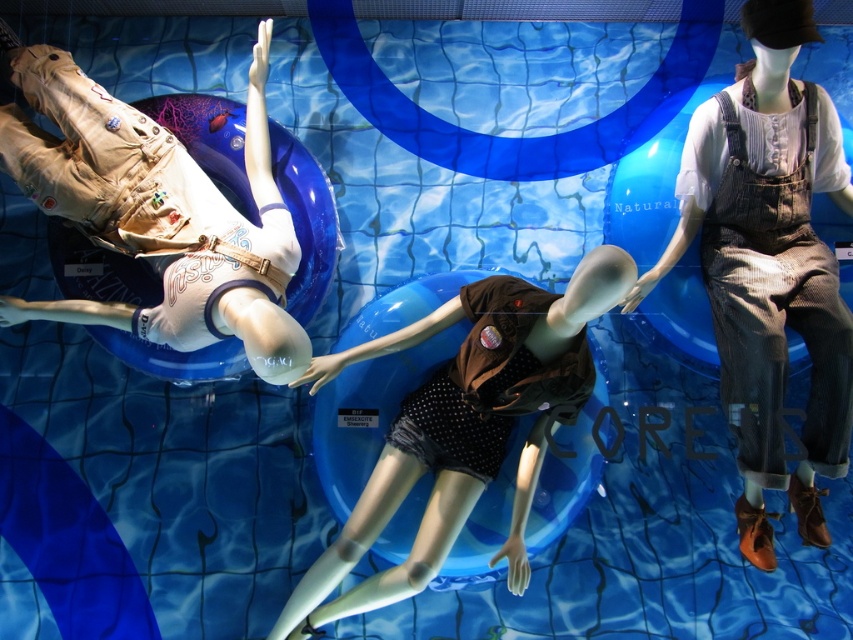
Question: Which point is farther to the camera?

Choices:
 (A) (485, 289)
 (B) (718, 99)
 (C) (776, 108)
 (D) (55, 154)

Answer: (B)

Question: Based on their relative distances, which object is nearer to the denim overalls at right?

Choices:
 (A) matte khaki pants at left
 (B) brown corduroy overalls at right

Answer: (B)

Question: Does brown dotted fabric at center come behind brown corduroy overalls at right?

Choices:
 (A) no
 (B) yes

Answer: (A)

Question: Is matte khaki pants at left wider than brown corduroy overalls at right?

Choices:
 (A) no
 (B) yes

Answer: (B)

Question: Does denim overalls at right appear under brown corduroy overalls at right?

Choices:
 (A) yes
 (B) no

Answer: (A)

Question: Which object appears farthest from the camera in this image?

Choices:
 (A) brown corduroy overalls at right
 (B) denim overalls at right

Answer: (A)